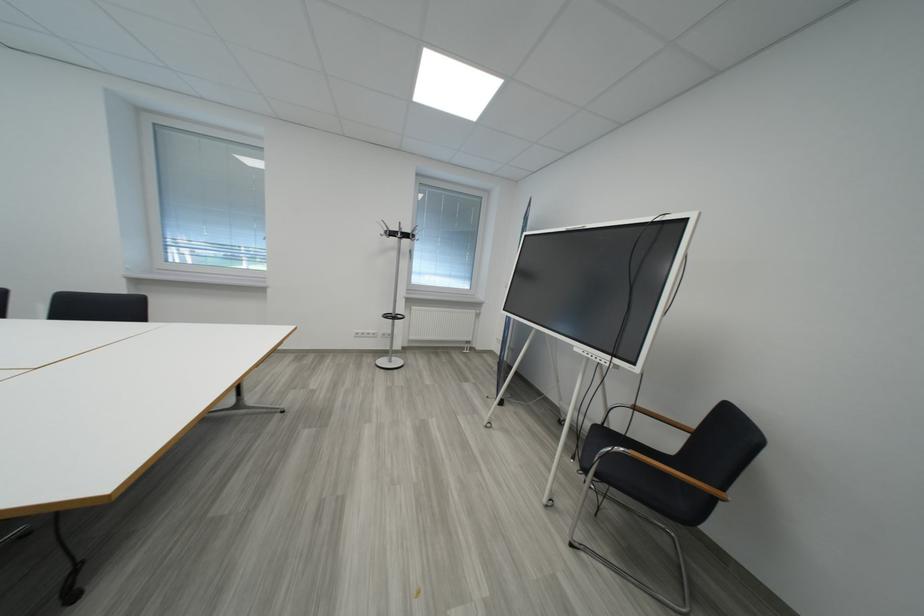
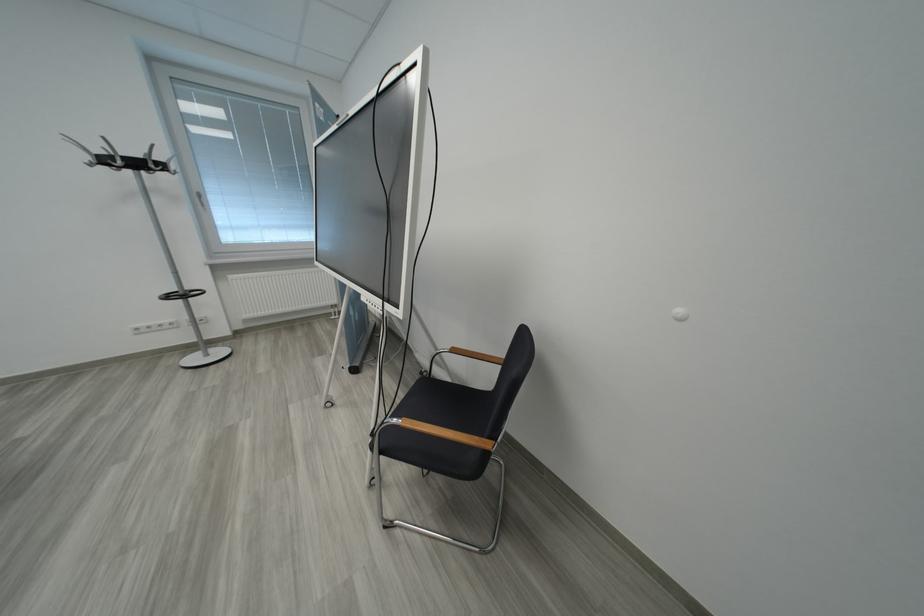
What movement of the cameraman would produce the second image?

The cameraman walked toward right, forward.